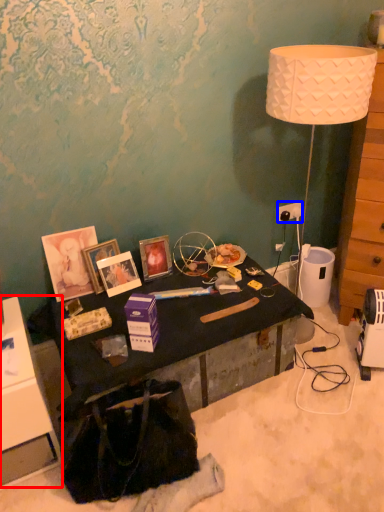
Question: Which object appears farthest to the camera in this image, cabinetry (highlighted by a red box) or power outlet (highlighted by a blue box)?

Choices:
 (A) cabinetry
 (B) power outlet

Answer: (B)